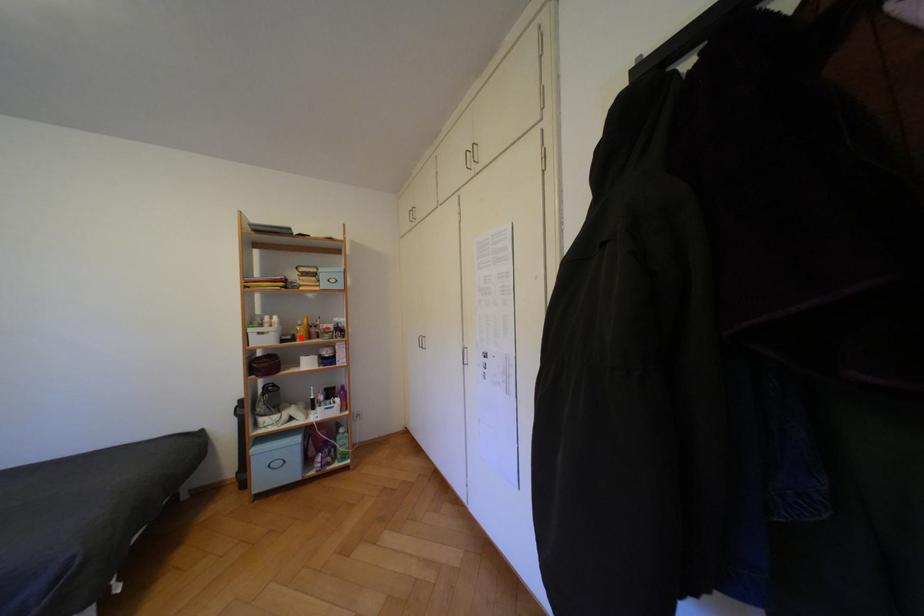
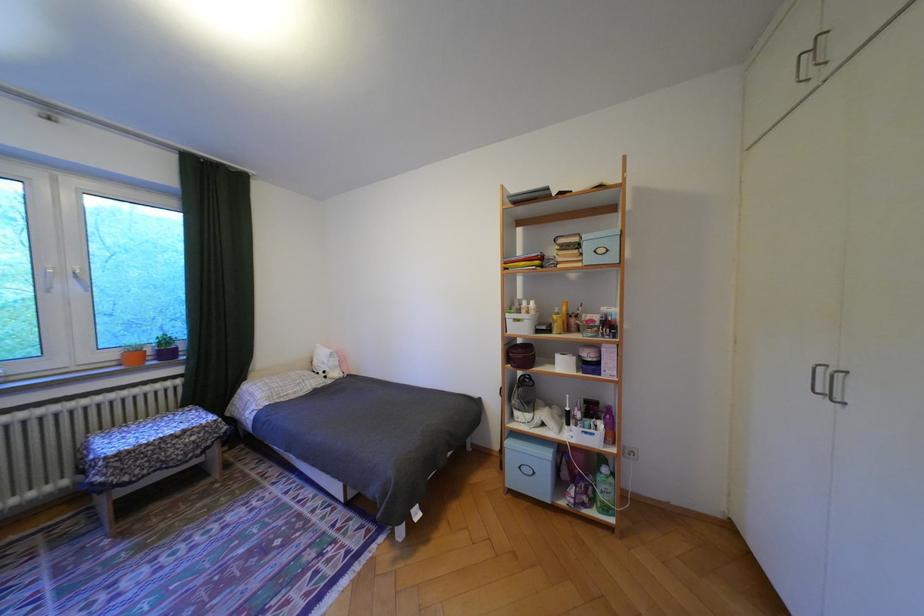
In the second image, find the point that corresponds to the highlighted location in the first image.

(555, 328)